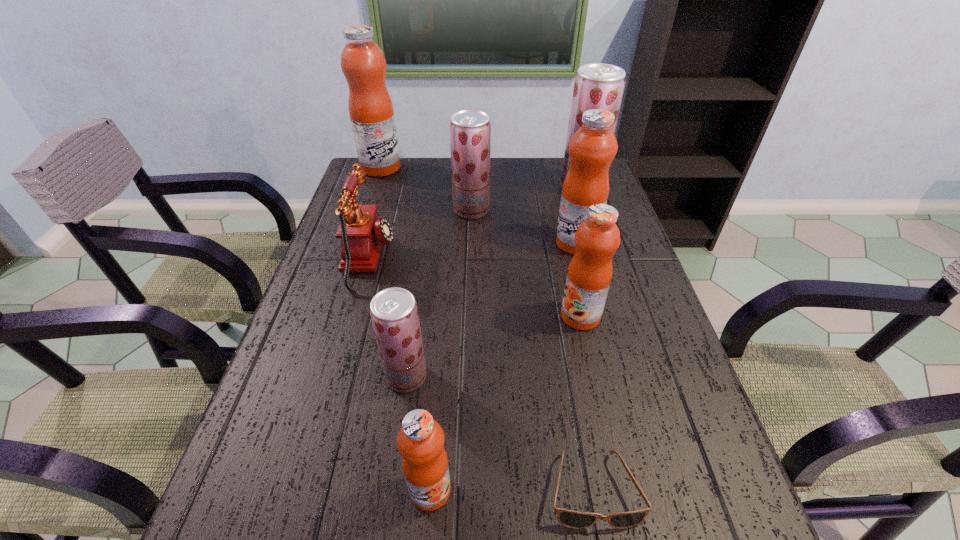
The width and height of the screenshot is (960, 540). I want to click on telephone, so click(x=362, y=233).

The image size is (960, 540). I want to click on the smallest strawberry fruit juice, so click(394, 313).

At what (x,y) coordinates should I click in order to perform the action: click on the second nearest fruit juice. Please return your answer as a coordinate pair (x, y). Looking at the image, I should click on 394,313.

Find the location of `the third orange fruit juice from right to left`. the third orange fruit juice from right to left is located at coordinates (420, 441).

Find the location of a particular element. The image size is (960, 540). the smallest orange fruit juice is located at coordinates (420, 441).

Where is `sunglasses`? The image size is (960, 540). sunglasses is located at coordinates (573, 519).

Find the location of a particular element. The width and height of the screenshot is (960, 540). free location located on the front label of the leftmost orange fruit juice is located at coordinates (441, 168).

At what (x,y) coordinates should I click in order to perform the action: click on vacant space situated 0.050m on the front of the rightmost strawberry fruit juice. Please return your answer as a coordinate pair (x, y). Looking at the image, I should click on (588, 208).

Identify the location of free space located on the front label of the second farthest orange fruit juice. (585, 276).

At what (x,y) coordinates should I click in order to perform the action: click on free space located on the right of the second strawberry fruit juice from left to right. Please return your answer as a coordinate pair (x, y). This screenshot has height=540, width=960. Looking at the image, I should click on pos(547,210).